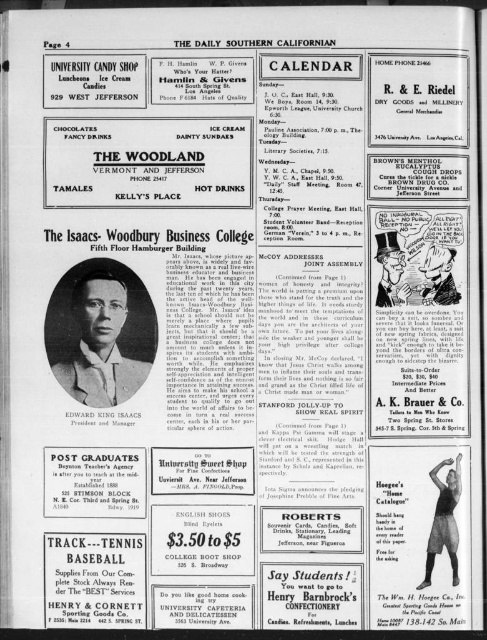
You are a newspaper editor reviewing the layout of the page. You notice the black fabric mannequin at center and the matte red tie at center. Which object is positioned to the right of the other?

The black fabric mannequin at center is positioned on the right side of matte red tie at center.

You are a newspaper editor reviewing this page. You notice the black paper portrait at center and the black fabric mannequin at center. Which one takes up more space on the page?

The black paper portrait at center is bigger than the black fabric mannequin at center, so it takes up more space on the page.